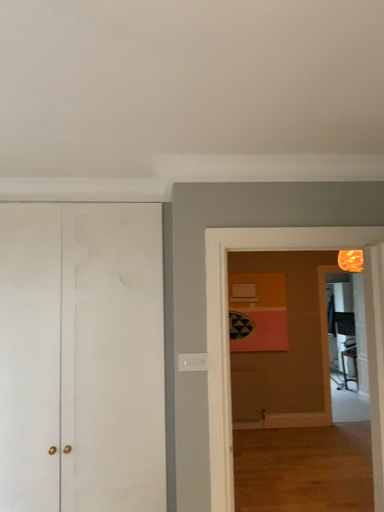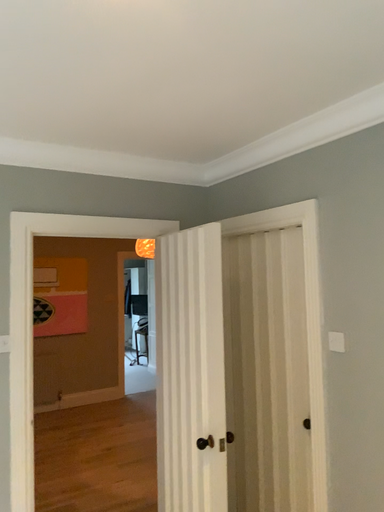
Question: How did the camera likely rotate when shooting the video?

Choices:
 (A) rotated left
 (B) rotated right

Answer: (B)